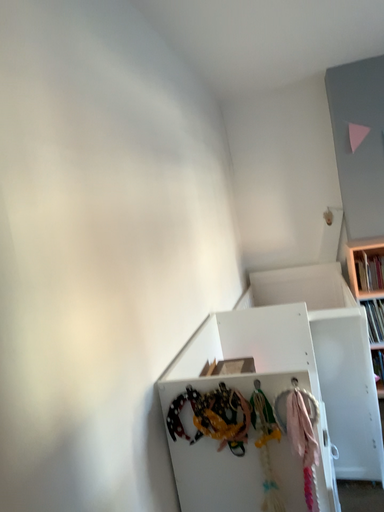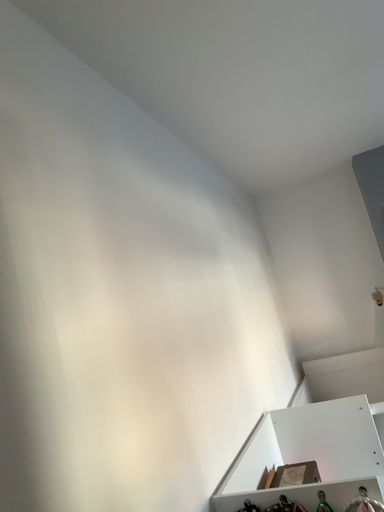
Question: How did the camera likely rotate when shooting the video?

Choices:
 (A) rotated left
 (B) rotated right

Answer: (A)